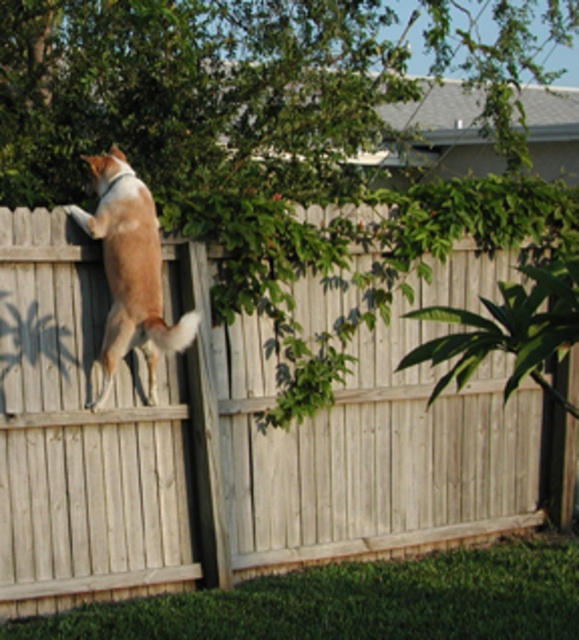
Looking at this image, is light brown wooden fence at upper left shorter than brown furry dog at upper center?

No, light brown wooden fence at upper left is not shorter than brown furry dog at upper center.

Does light brown wooden fence at upper left have a smaller size compared to brown furry dog at upper center?

Actually, light brown wooden fence at upper left might be larger than brown furry dog at upper center.

Between point (31, 256) and point (151, 300), which one is positioned in front?

Point (151, 300)

This screenshot has width=579, height=640. What are the coordinates of `light brown wooden fence at upper left` in the screenshot? It's located at (233, 444).